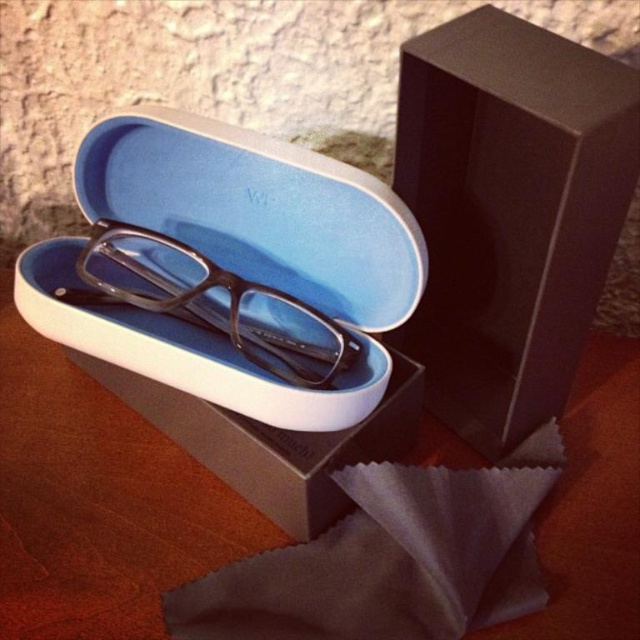
Looking at this image, does matte black box at upper right have a lesser height compared to matte black glasses at center?

No, matte black box at upper right is not shorter than matte black glasses at center.

Is point (420, 129) less distant than point (307, 316)?

Yes.

The height and width of the screenshot is (640, 640). In order to click on matte black box at upper right in this screenshot , I will do `click(509, 212)`.

Who is taller, matte black case at center or matte black glasses at center?

Standing taller between the two is matte black case at center.

Is matte black case at center above matte black glasses at center?

Yes, matte black case at center is above matte black glasses at center.

Is point (228, 193) closer to camera compared to point (244, 333)?

Yes, point (228, 193) is in front of point (244, 333).

Find the location of a particular element. This screenshot has width=640, height=640. matte black case at center is located at coordinates (243, 301).

Which is behind, point (349, 502) or point (412, 211)?

The point (349, 502) is behind.

Can you confirm if matte black case at center is thinner than matte black box at upper right?

No.

Where is `matte black case at center`? Image resolution: width=640 pixels, height=640 pixels. matte black case at center is located at coordinates (243, 301).